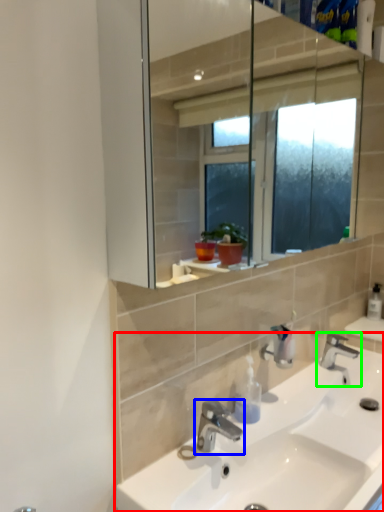
Question: Based on their relative distances, which object is nearer to sink (highlighted by a red box)? Choose from tap (highlighted by a blue box) and tap (highlighted by a green box).

Choices:
 (A) tap
 (B) tap

Answer: (A)